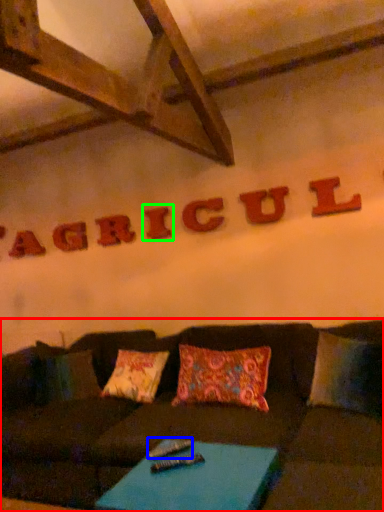
Question: Which object is positioned farthest from studio couch (highlighted by a red box)? Select from remote (highlighted by a blue box) and letter (highlighted by a green box).

Choices:
 (A) remote
 (B) letter

Answer: (B)